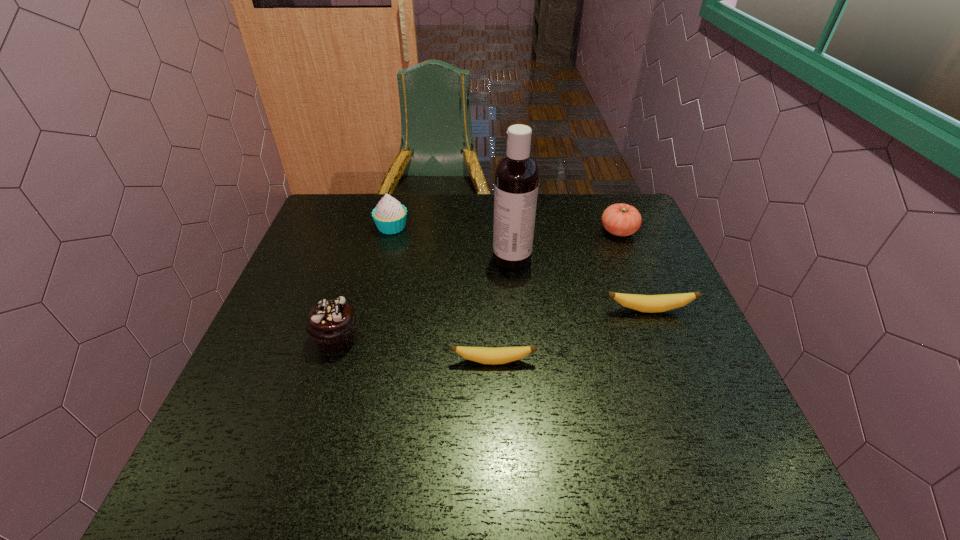
Image resolution: width=960 pixels, height=540 pixels. In order to click on vacant point located 0.100m on the front of the right banana in this screenshot , I will do `click(663, 348)`.

You are a GUI agent. You are given a task and a screenshot of the screen. Output one action in this format:
    pyautogui.click(x=<x>, y=<y>)
    Task: Click on the free space located on the right of the farther cupcake
    The width and height of the screenshot is (960, 540).
    Given the screenshot: What is the action you would take?
    pyautogui.click(x=438, y=227)

Where is `vacant region located on the label side of the dishwasher detergent`? Image resolution: width=960 pixels, height=540 pixels. vacant region located on the label side of the dishwasher detergent is located at coordinates (465, 258).

Where is `free space located 0.110m on the label side of the dishwasher detergent`? This screenshot has width=960, height=540. free space located 0.110m on the label side of the dishwasher detergent is located at coordinates (454, 258).

The width and height of the screenshot is (960, 540). What are the coordinates of `vacant space located on the label side of the dishwasher detergent` in the screenshot? It's located at (391, 258).

Identify the location of vacant space located on the left of the tomato. click(x=508, y=231).

This screenshot has width=960, height=540. I want to click on free region located on the back of the nearer cupcake, so click(362, 255).

I want to click on cupcake located in the far edge section of the desktop, so click(x=390, y=216).

This screenshot has height=540, width=960. In order to click on tomato that is at the far edge in this screenshot , I will do `click(621, 219)`.

Where is `object at the left edge`? The width and height of the screenshot is (960, 540). object at the left edge is located at coordinates (331, 324).